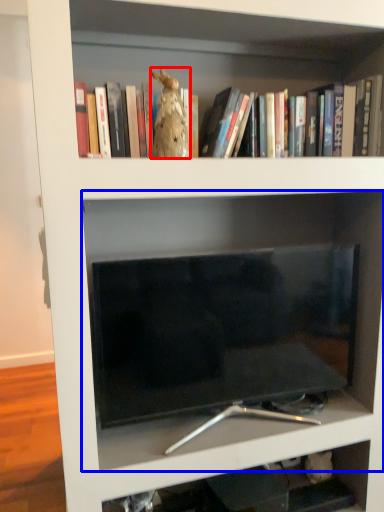
Question: Which object appears farthest to the camera in this image, animal (highlighted by a red box) or shelf (highlighted by a blue box)?

Choices:
 (A) animal
 (B) shelf

Answer: (B)